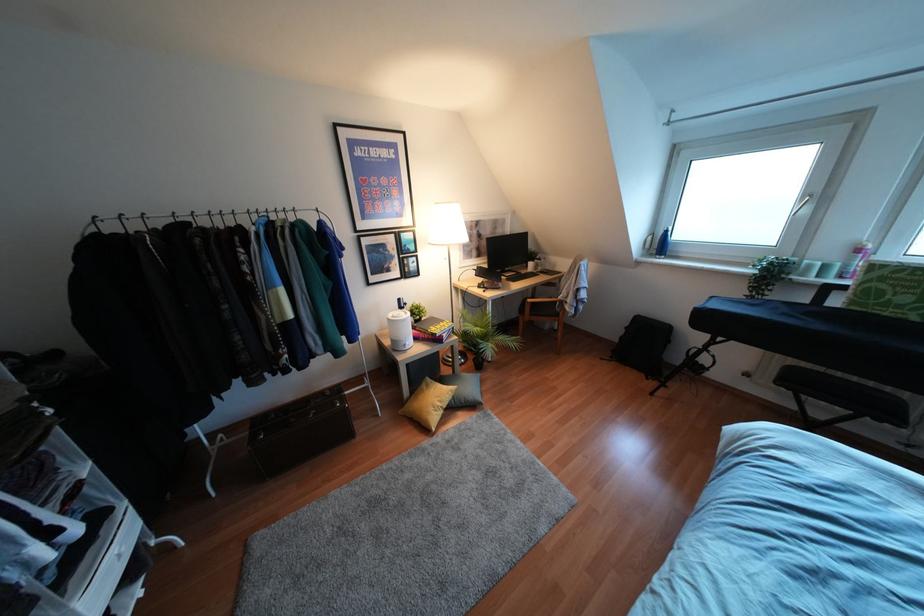
Identify the location of black backpack. This screenshot has height=616, width=924. (642, 345).